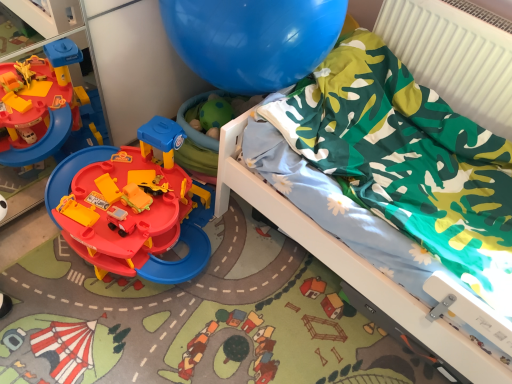
Question: Is green fabric at upper right turned away from green camouflage fabric at upper right?

Choices:
 (A) no
 (B) yes

Answer: (A)

Question: From the image's perspective, is green fabric at upper right over green camouflage fabric at upper right?

Choices:
 (A) yes
 (B) no

Answer: (A)

Question: Is green fabric at upper right smaller than green camouflage fabric at upper right?

Choices:
 (A) yes
 (B) no

Answer: (A)

Question: Is green fabric at upper right to the right of green camouflage fabric at upper right from the viewer's perspective?

Choices:
 (A) yes
 (B) no

Answer: (A)

Question: Can you confirm if green fabric at upper right is bigger than green camouflage fabric at upper right?

Choices:
 (A) yes
 (B) no

Answer: (B)

Question: Is green fabric at upper right with green camouflage fabric at upper right?

Choices:
 (A) no
 (B) yes

Answer: (A)

Question: Does green camouflage fabric at upper right have a larger size compared to green fabric at upper right?

Choices:
 (A) yes
 (B) no

Answer: (A)

Question: Considering the relative sizes of green camouflage fabric at upper right and green fabric at upper right in the image provided, is green camouflage fabric at upper right wider than green fabric at upper right?

Choices:
 (A) no
 (B) yes

Answer: (B)

Question: Considering the relative sizes of green camouflage fabric at upper right and green fabric at upper right in the image provided, is green camouflage fabric at upper right thinner than green fabric at upper right?

Choices:
 (A) no
 (B) yes

Answer: (A)

Question: From the image's perspective, is green camouflage fabric at upper right located above green fabric at upper right?

Choices:
 (A) yes
 (B) no

Answer: (B)

Question: From a real-world perspective, is green camouflage fabric at upper right on top of green fabric at upper right?

Choices:
 (A) no
 (B) yes

Answer: (A)

Question: From the image's perspective, is green camouflage fabric at upper right below green fabric at upper right?

Choices:
 (A) yes
 (B) no

Answer: (A)

Question: Is green camouflage fabric at upper right in front of or behind green fabric at upper right in the image?

Choices:
 (A) behind
 (B) front

Answer: (B)